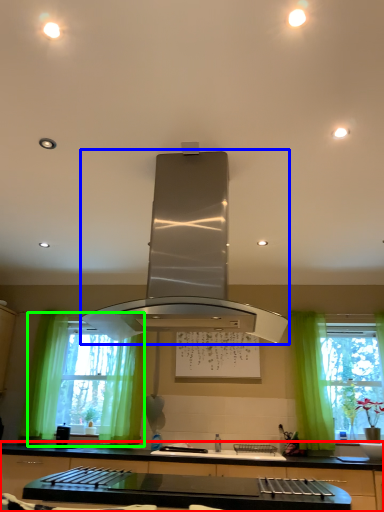
Question: Estimate the real-world distances between objects in this image. Which object is farther from countertop (highlighted by a red box), home appliance (highlighted by a blue box) or window (highlighted by a green box)?

Choices:
 (A) home appliance
 (B) window

Answer: (A)